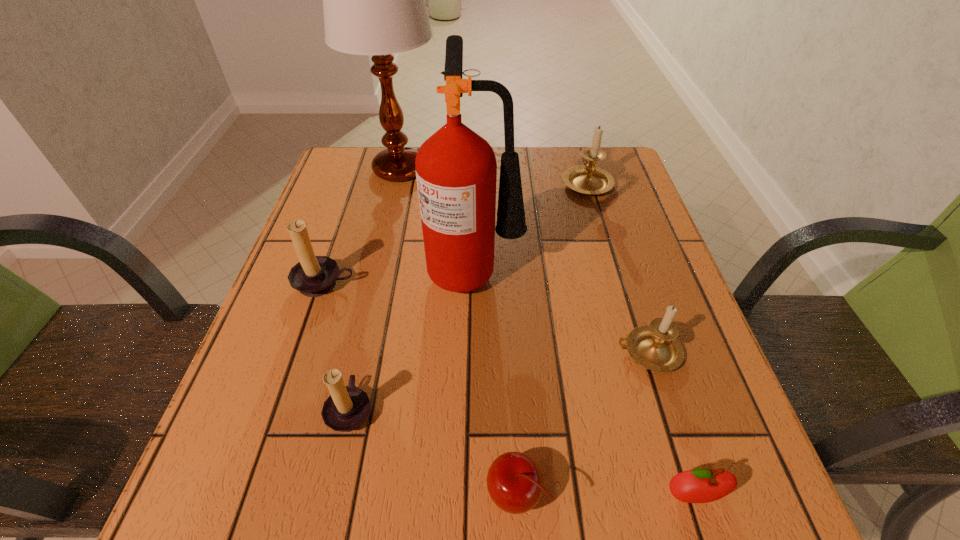
The height and width of the screenshot is (540, 960). I want to click on white table lamp, so pos(374,4).

The image size is (960, 540). Identify the location of red fire extinguisher. (456, 170).

The image size is (960, 540). What are the coordinates of `the farther beige candle holder` in the screenshot? It's located at (588, 179).

Locate an element on the screen. This screenshot has height=540, width=960. the bigger beige candle holder is located at coordinates (588, 179).

This screenshot has width=960, height=540. Find the location of `the left brown candle holder`. the left brown candle holder is located at coordinates (314, 276).

Find the location of `the farther brown candle holder`. the farther brown candle holder is located at coordinates (314, 276).

Find the location of a particular element. the third nearest object is located at coordinates (347, 407).

Identify the location of the right brown candle holder. (347, 407).

Image resolution: width=960 pixels, height=540 pixels. In order to click on the fourth nearest object in this screenshot , I will do `click(655, 346)`.

The image size is (960, 540). I want to click on the smaller beige candle holder, so click(655, 346).